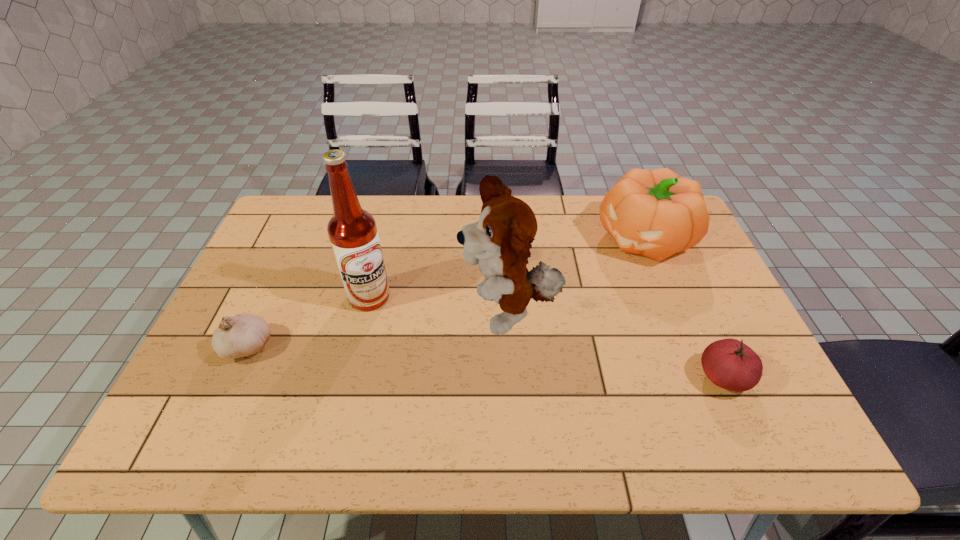
Locate an element on the screen. The height and width of the screenshot is (540, 960). free space between the third object from left to right and the leftmost object is located at coordinates (378, 331).

Locate an element on the screen. free point between the tomato and the garlic is located at coordinates (x=485, y=362).

This screenshot has height=540, width=960. In order to click on free space between the second object from left to right and the tomato in this screenshot , I will do `click(546, 337)`.

This screenshot has width=960, height=540. Find the location of `free space between the third object from right to left and the alcohol`. free space between the third object from right to left and the alcohol is located at coordinates (440, 306).

The image size is (960, 540). Identify the location of blank region between the tomato and the fourth object from right to left. (546, 337).

You are a GUI agent. You are given a task and a screenshot of the screen. Output one action in this format:
    pyautogui.click(x=<x>, y=<y>)
    Task: Click on the empty location between the puppy and the farthest object
    Image resolution: width=960 pixels, height=540 pixels.
    Given the screenshot: What is the action you would take?
    pyautogui.click(x=577, y=277)

You are a GUI agent. You are given a task and a screenshot of the screen. Output one action in this format:
    pyautogui.click(x=<x>, y=<y>)
    Task: Click on the empty space that is in between the tomato and the alcohol
    The width and height of the screenshot is (960, 540).
    Given the screenshot: What is the action you would take?
    pyautogui.click(x=546, y=337)

The height and width of the screenshot is (540, 960). I want to click on free spot between the leftmost object and the tomato, so click(485, 362).

Find the location of a particular element. The height and width of the screenshot is (540, 960). free space between the farthest object and the garlic is located at coordinates (446, 293).

Locate an element on the screen. This screenshot has width=960, height=540. object that is the closest to the third object from left to right is located at coordinates (656, 213).